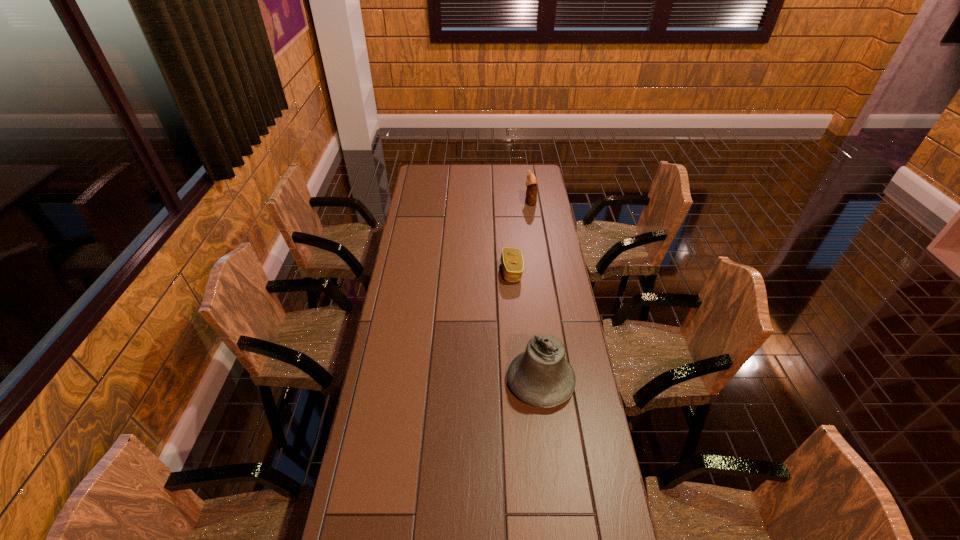
The height and width of the screenshot is (540, 960). Find the location of `vacant region between the bell and the second farthest object`. vacant region between the bell and the second farthest object is located at coordinates (526, 327).

At what (x,y) coordinates should I click in order to perform the action: click on free area in between the taller clutch bag and the nearer clutch bag. Please return your answer as a coordinate pair (x, y). The height and width of the screenshot is (540, 960). Looking at the image, I should click on (521, 237).

I want to click on vacant point located between the farthest object and the tallest object, so click(536, 292).

Where is `free space between the taller clutch bag and the left clutch bag`? free space between the taller clutch bag and the left clutch bag is located at coordinates (521, 237).

This screenshot has height=540, width=960. What are the coordinates of `vacant space that's between the nearest object and the farther clutch bag` in the screenshot? It's located at (536, 292).

Find the location of a particular element. The height and width of the screenshot is (540, 960). free area in between the bell and the taller clutch bag is located at coordinates (536, 292).

Identify which object is the second closest to the right clutch bag. Please provide its 2D coordinates. Your answer should be formatted as a tuple, i.e. [(x, y)], where the tuple contains the x and y coordinates of a point satisfying the conditions above.

[(541, 376)]

Image resolution: width=960 pixels, height=540 pixels. What are the coordinates of `object that is the second closest to the second nearest object` in the screenshot? It's located at (531, 182).

The width and height of the screenshot is (960, 540). What are the coordinates of `free spot that satisfies the following two spatial constraints: 1. on the open side of the farthest object; 2. on the front side of the bell` in the screenshot? It's located at (557, 382).

You are a GUI agent. You are given a task and a screenshot of the screen. Output one action in this format:
    pyautogui.click(x=<x>, y=<y>)
    Task: Click on the vacant point that satisfies the following two spatial constraints: 1. on the back side of the tallest object; 2. on the zipper side of the second farthest object
    Image resolution: width=960 pixels, height=540 pixels.
    Given the screenshot: What is the action you would take?
    pyautogui.click(x=528, y=272)